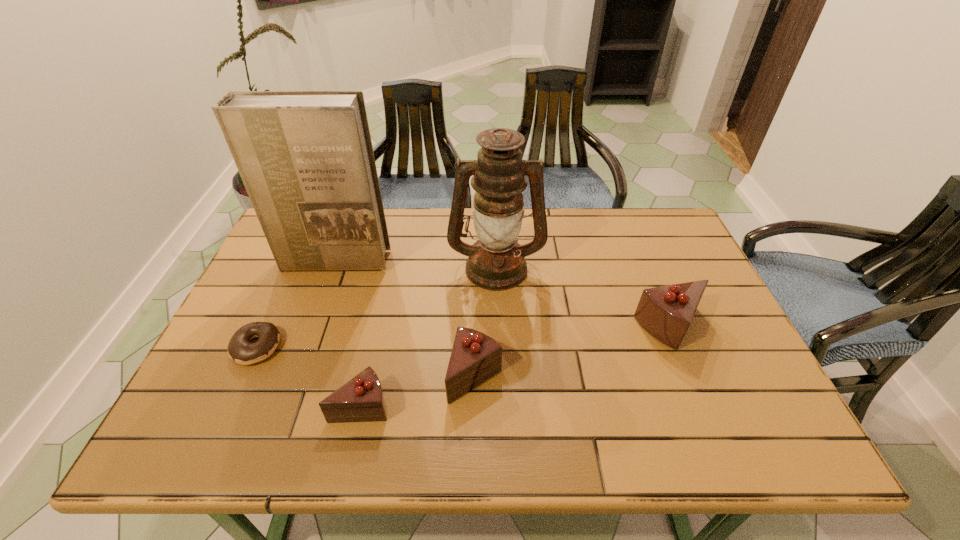
The width and height of the screenshot is (960, 540). Find the location of `free space between the second tallest chocolate cake and the phonebook`. free space between the second tallest chocolate cake and the phonebook is located at coordinates click(x=405, y=318).

Locate an element on the screen. Image resolution: width=960 pixels, height=540 pixels. free spot between the phonebook and the third shortest object is located at coordinates (405, 318).

Find the location of a particular element. The width and height of the screenshot is (960, 540). vacant region between the leftmost chocolate cake and the rightmost object is located at coordinates (516, 366).

Where is `object that is the fifth nearest to the phonebook`? The image size is (960, 540). object that is the fifth nearest to the phonebook is located at coordinates (666, 312).

At what (x,y) coordinates should I click in order to perform the action: click on the second closest object to the rightmost object. Please return your answer as a coordinate pair (x, y). Looking at the image, I should click on (475, 357).

At what (x,y) coordinates should I click in order to perform the action: click on chocolate cake identified as the closest to the shortest object. Please return your answer as a coordinate pair (x, y). Looking at the image, I should click on (361, 399).

At what (x,y) coordinates should I click in order to perform the action: click on chocolate cake that is the closest to the rightmost chocolate cake. Please return your answer as a coordinate pair (x, y). The image size is (960, 540). Looking at the image, I should click on (475, 357).

Where is `free space that satisfies the following two spatial constraints: 1. on the back side of the rightmost chocolate cake; 2. on the left side of the shortest object`? The width and height of the screenshot is (960, 540). free space that satisfies the following two spatial constraints: 1. on the back side of the rightmost chocolate cake; 2. on the left side of the shortest object is located at coordinates (265, 327).

You are a GUI agent. You are given a task and a screenshot of the screen. Output one action in this format:
    pyautogui.click(x=<x>, y=<y>)
    Task: Click on the vacant space that satisfies the following two spatial constraints: 1. on the cover of the second tallest chocolate cake; 2. on the left side of the phonebook
    The width and height of the screenshot is (960, 540).
    Given the screenshot: What is the action you would take?
    pyautogui.click(x=292, y=376)

The width and height of the screenshot is (960, 540). Find the location of `vacant area in the image that satisfies the following two spatial constraints: 1. on the cover of the lantern; 2. on the right side of the phonebook`. vacant area in the image that satisfies the following two spatial constraints: 1. on the cover of the lantern; 2. on the right side of the phonebook is located at coordinates (332, 267).